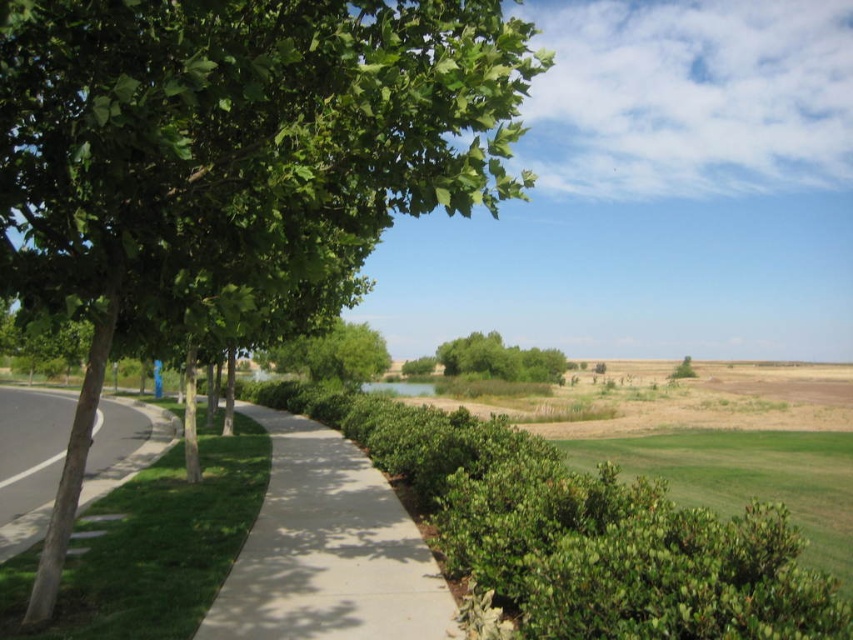
Question: Which of these objects is positioned farthest from the concrete sidewalk at center?

Choices:
 (A) green leafy bush at center
 (B) green leafy tree at center
 (C) green leafy tree at left
 (D) green soft grass at left

Answer: (B)

Question: Does concrete sidewalk at center have a greater width compared to green leafy bush at center?

Choices:
 (A) yes
 (B) no

Answer: (B)

Question: Which object appears farthest from the camera in this image?

Choices:
 (A) green leafy tree at center
 (B) green soft grass at left
 (C) green leafy tree at left
 (D) green leafy bush at center

Answer: (A)

Question: Observing the image, what is the correct spatial positioning of green leafy tree at left in reference to green soft grass at left?

Choices:
 (A) right
 (B) left

Answer: (A)

Question: Which is nearer to the green soft grass at left?

Choices:
 (A) green leafy bush at center
 (B) green leafy tree at center

Answer: (A)

Question: Does green leafy tree at left lie behind green leafy bush at center?

Choices:
 (A) no
 (B) yes

Answer: (A)